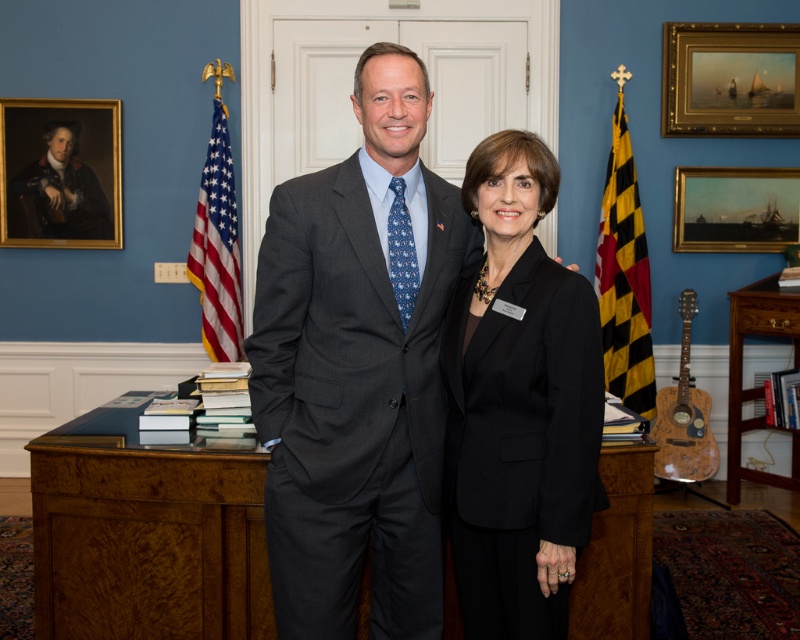
Question: Which object is farther from the camera taking this photo?

Choices:
 (A) american flag at left
 (B) dark gray suit at center
 (C) yellow/black checkered flag at right

Answer: (C)

Question: Is black matte blazer at center smaller than american flag at left?

Choices:
 (A) yes
 (B) no

Answer: (B)

Question: Which object is the farthest from the goldwooden frame at upper right?

Choices:
 (A) brown wood bookshelf at right
 (B) gold-framed painting at upper right
 (C) black matte blazer at center

Answer: (C)

Question: Which object is the closest to the dark gray suit at center?

Choices:
 (A) yellow/black checkered flag at right
 (B) brown wood bookshelf at right
 (C) black matte blazer at center

Answer: (C)

Question: Does gold-framed portrait at upper left appear on the left side of brown wood bookshelf at right?

Choices:
 (A) yes
 (B) no

Answer: (A)

Question: Where is dark gray suit at center located in relation to gold-framed portrait at upper left in the image?

Choices:
 (A) above
 (B) below

Answer: (B)